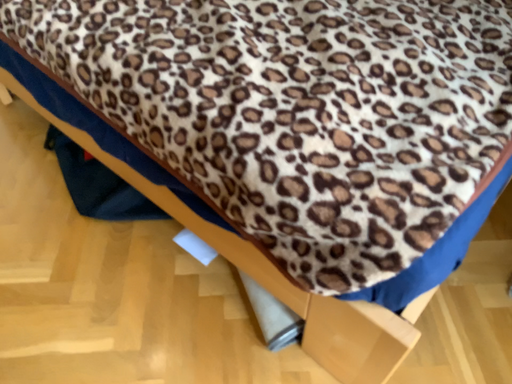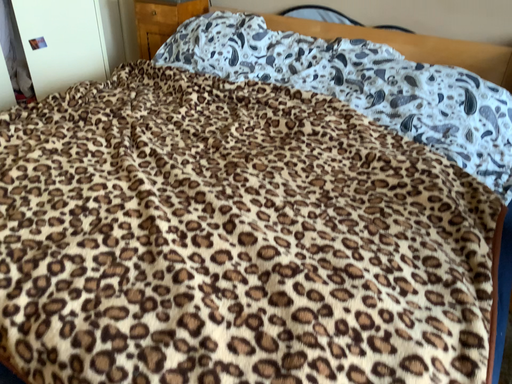
Question: Which way did the camera rotate in the video?

Choices:
 (A) rotated upward
 (B) rotated downward

Answer: (A)